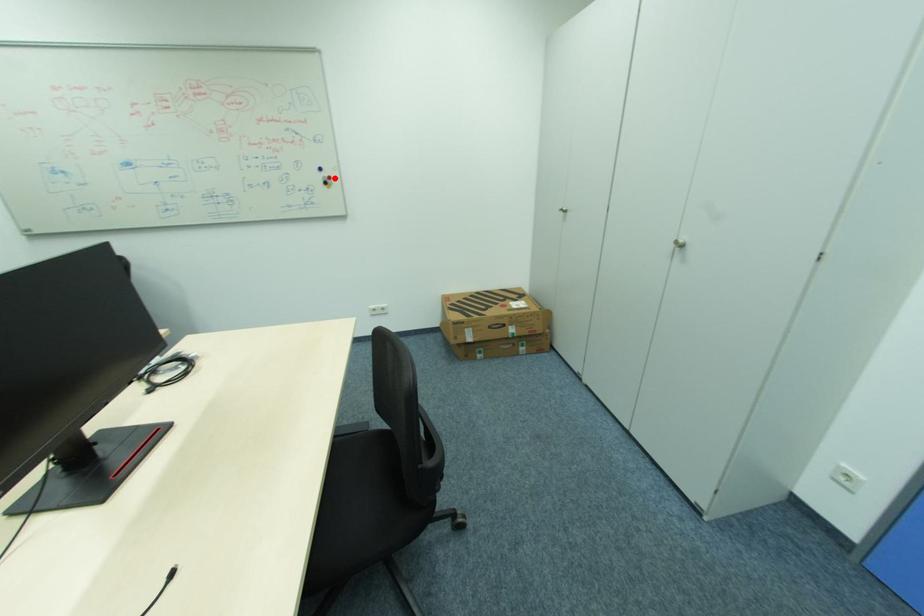
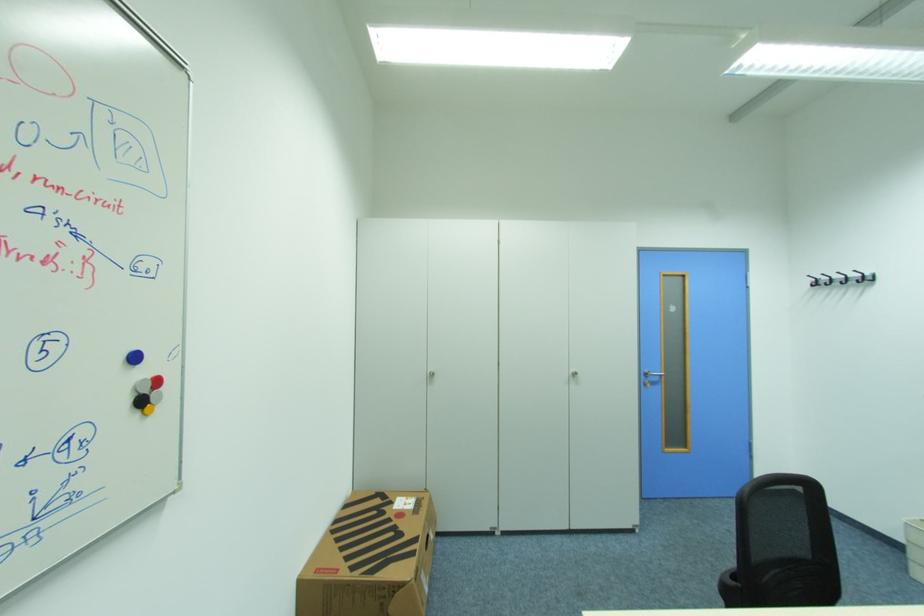
Question: I am providing you with two images of the same scene from different viewpoints. In image1, a red point is highlighted. Considering the same 3D point in image2, which of the following is correct?

Choices:
 (A) It is closer
 (B) It is farther

Answer: (B)